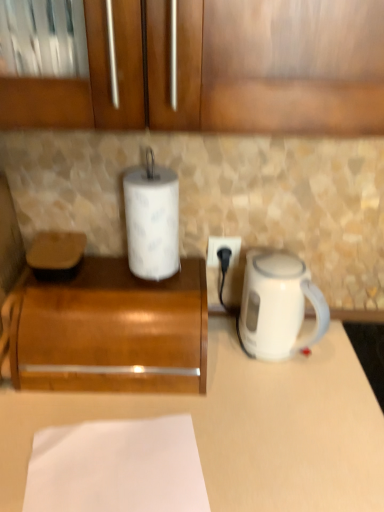
Where is `free location to the right of white glossy electric kettle at right`? The height and width of the screenshot is (512, 384). free location to the right of white glossy electric kettle at right is located at coordinates (349, 353).